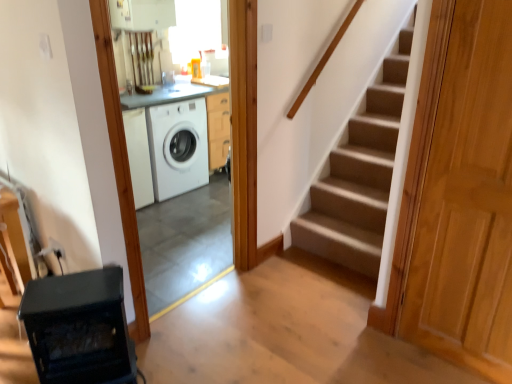
Question: Is point (129, 337) positioned closer to the camera than point (225, 137)?

Choices:
 (A) closer
 (B) farther

Answer: (A)

Question: Is black glass stove at lower left wider or thinner than white glossy washing machine at center?

Choices:
 (A) wide
 (B) thin

Answer: (A)

Question: Which is farther from the light brown wooden door at right?

Choices:
 (A) white glossy washing machine at center
 (B) white glossy washing machine at center
 (C) black glass stove at lower left

Answer: (B)

Question: Estimate the real-world distances between objects in this image. Which object is farther from the white glossy washing machine at center?

Choices:
 (A) black glass stove at lower left
 (B) light brown wooden door at right
 (C) white glossy washing machine at center

Answer: (B)